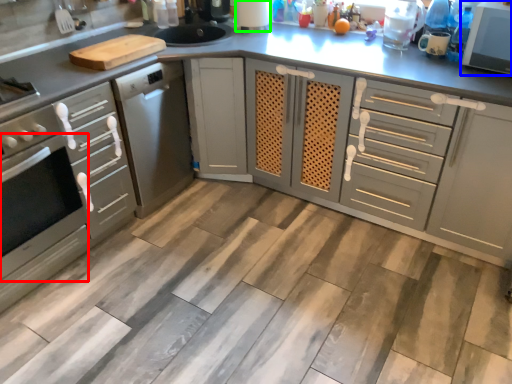
Question: Which is farther away from oven (highlighted by a red box)? home appliance (highlighted by a blue box) or appliance (highlighted by a green box)?

Choices:
 (A) home appliance
 (B) appliance

Answer: (A)